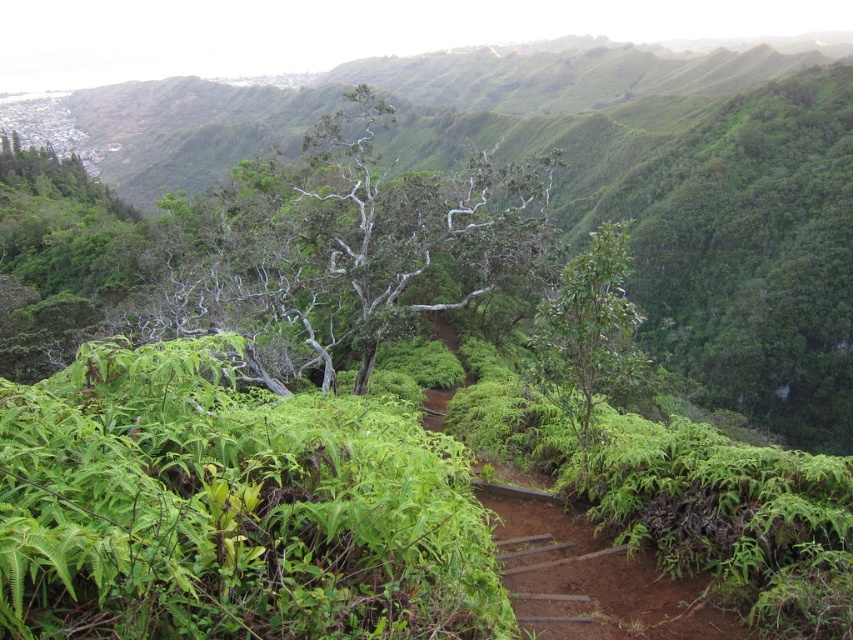
Does silver bark tree at center appear on the left side of green glossy tree at center?

Yes, silver bark tree at center is to the left of green glossy tree at center.

Is silver bark tree at center closer to the viewer compared to green glossy tree at center?

No.

Locate an element on the screen. Image resolution: width=853 pixels, height=640 pixels. silver bark tree at center is located at coordinates (341, 244).